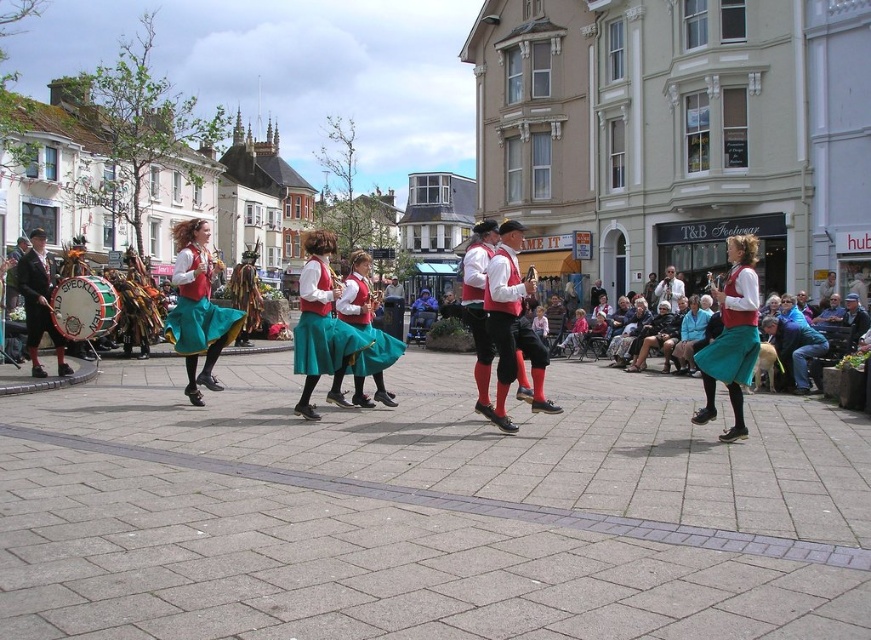
You are a photographer standing at the center of the town square. You want to take a photo that includes both the point at coordinates point(208, 305) and point(32, 353). Based on their positions, which point should you position closer to the front of your camera frame?

Point(208, 305) should be positioned closer to the front of your camera frame because it is in front of point(32, 353) according to the spatial description.

You are standing in the town square and want to take a photo of both the point at coordinates point (741,323) and point (321,314). Since you want both points in focus, which point should you focus on to ensure both are sharp?

You should focus on the point closer to the camera, which is point (741,323). This ensures that both it and the farther point (321,314) will be in focus due to the depth of field extending beyond the focused point.

You are a photographer standing at the edge of the square, and you want to take a photo of the matte red skirt at center and the matte red vest at center so that both are clearly visible in the frame. Given that your camera has a maximum focus range of 14 meters, will you be able to capture both objects in focus?

The matte red skirt at center is 14.58 meters away from the matte red vest at center. Since the distance between them exceeds the camera maximum focus range of 14 meters, you won not be able to capture both objects in focus simultaneously.